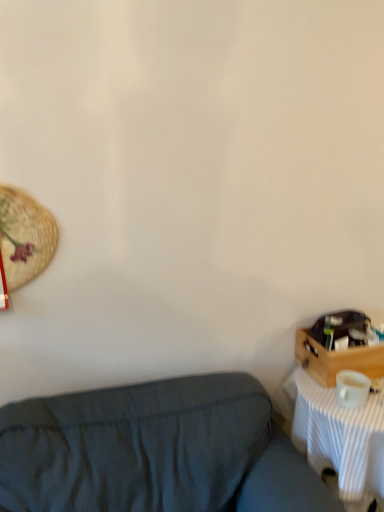
Question: Is dark blue fabric couch at lower left a part of wooden crate at right?

Choices:
 (A) no
 (B) yes

Answer: (A)

Question: Can you confirm if wooden crate at right is shorter than dark blue fabric couch at lower left?

Choices:
 (A) no
 (B) yes

Answer: (B)

Question: Is wooden crate at right not near dark blue fabric couch at lower left?

Choices:
 (A) yes
 (B) no

Answer: (B)

Question: Considering the relative sizes of wooden crate at right and dark blue fabric couch at lower left in the image provided, is wooden crate at right thinner than dark blue fabric couch at lower left?

Choices:
 (A) yes
 (B) no

Answer: (A)

Question: Considering the relative positions of wooden crate at right and dark blue fabric couch at lower left in the image provided, is wooden crate at right in front of dark blue fabric couch at lower left?

Choices:
 (A) yes
 (B) no

Answer: (B)

Question: Is wooden crate at right touching dark blue fabric couch at lower left?

Choices:
 (A) no
 (B) yes

Answer: (A)

Question: From the image's perspective, is white matte coffee cup at right on top of dark blue fabric couch at lower left?

Choices:
 (A) yes
 (B) no

Answer: (A)

Question: Does white matte coffee cup at right have a smaller size compared to dark blue fabric couch at lower left?

Choices:
 (A) no
 (B) yes

Answer: (B)

Question: Considering the relative sizes of white matte coffee cup at right and dark blue fabric couch at lower left in the image provided, is white matte coffee cup at right thinner than dark blue fabric couch at lower left?

Choices:
 (A) yes
 (B) no

Answer: (A)

Question: Is white matte coffee cup at right next to dark blue fabric couch at lower left and touching it?

Choices:
 (A) no
 (B) yes

Answer: (A)

Question: Considering the relative positions of white matte coffee cup at right and dark blue fabric couch at lower left in the image provided, is white matte coffee cup at right to the left of dark blue fabric couch at lower left from the viewer's perspective?

Choices:
 (A) no
 (B) yes

Answer: (A)

Question: Does white matte coffee cup at right have a lesser height compared to dark blue fabric couch at lower left?

Choices:
 (A) no
 (B) yes

Answer: (B)

Question: From a real-world perspective, is wooden crate at right below white matte coffee cup at right?

Choices:
 (A) no
 (B) yes

Answer: (A)